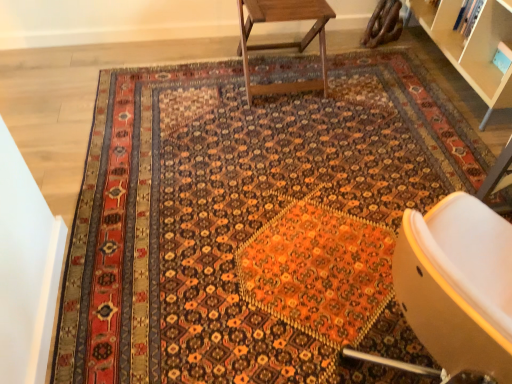
Question: From their relative heights in the image, would you say wooden table at upper center is taller or shorter than matte orange chair at lower right?

Choices:
 (A) tall
 (B) short

Answer: (B)

Question: Considering the positions of wooden table at upper center and matte orange chair at lower right in the image, is wooden table at upper center wider or thinner than matte orange chair at lower right?

Choices:
 (A) wide
 (B) thin

Answer: (B)

Question: Considering the relative positions of wooden table at upper center and matte orange chair at lower right in the image provided, is wooden table at upper center to the left or to the right of matte orange chair at lower right?

Choices:
 (A) left
 (B) right

Answer: (A)

Question: In terms of width, does matte orange chair at lower right look wider or thinner when compared to wooden table at upper center?

Choices:
 (A) wide
 (B) thin

Answer: (A)

Question: Is point (502, 221) closer or farther from the camera than point (334, 16)?

Choices:
 (A) farther
 (B) closer

Answer: (B)

Question: Is matte orange chair at lower right taller or shorter than wooden table at upper center?

Choices:
 (A) short
 (B) tall

Answer: (B)

Question: From a real-world perspective, is matte orange chair at lower right physically located above or below wooden table at upper center?

Choices:
 (A) above
 (B) below

Answer: (A)